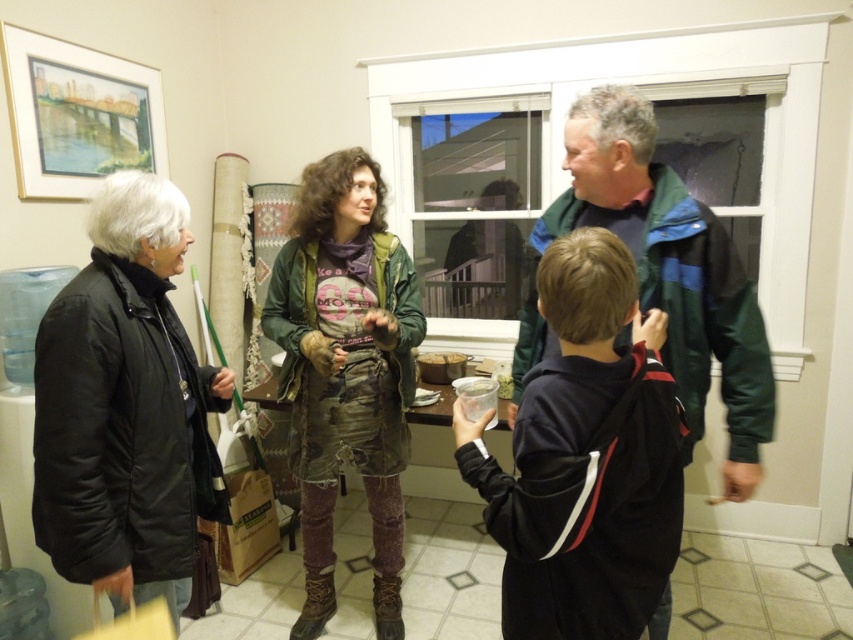
Question: Which point is closer to the camera?

Choices:
 (A) black puffy jacket at left
 (B) dark blue fleece jacket at center
 (C) rusty leather jacket at center

Answer: (B)

Question: Estimate the real-world distances between objects in this image. Which object is farther from the translucent plastic cup at center?

Choices:
 (A) green jacket at center
 (B) dark blue fleece jacket at center
 (C) rusty leather jacket at center

Answer: (B)

Question: Is black puffy jacket at left to the left of green jacket at center from the viewer's perspective?

Choices:
 (A) no
 (B) yes

Answer: (B)

Question: Is dark blue fleece jacket at center below rusty leather jacket at center?

Choices:
 (A) no
 (B) yes

Answer: (A)

Question: Can you confirm if rusty leather jacket at center is positioned to the right of green jacket at center?

Choices:
 (A) no
 (B) yes

Answer: (A)

Question: Which point is farther to the camera?

Choices:
 (A) rusty leather jacket at center
 (B) black puffy jacket at left

Answer: (A)